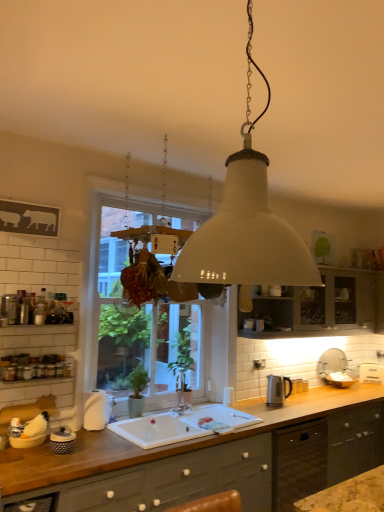
Where is `free space to the right of matte black container at lower left, which is the first appliance from left to right`? Image resolution: width=384 pixels, height=512 pixels. free space to the right of matte black container at lower left, which is the first appliance from left to right is located at coordinates (102, 454).